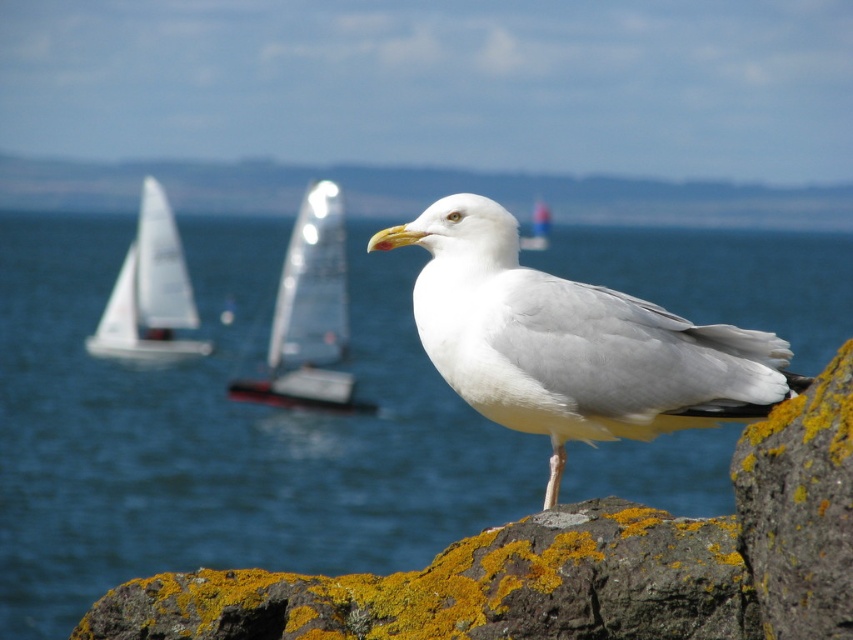
You are a photographer standing on the rocky surface where the white feathered bird at center is perched. You want to take a photo of the two sailboats in the background. How far apart are the two sailboats?

The two sailboats are 6.39 meters apart.

You are a photographer trying to capture the white feathered bird at center in the coastal scene. The camera is positioned at the point marked by coordinates point (572, 342). To ensure the bird is in focus, you need to know its exact location. Where exactly is the white feathered bird located?

The white feathered bird at center is located exactly at the coordinates marked by point (572, 342).

You are a photographer planning to capture a wide shot of the coastal scene. Given that the blue water at center takes up more space than the white glossy sailboat at center, which object should you focus on to ensure both are visible in the frame?

The blue water at center is bigger than the white glossy sailboat at center, so focusing on the blue water at center will ensure both are visible as the larger area can accommodate the smaller sailboat within the frame.